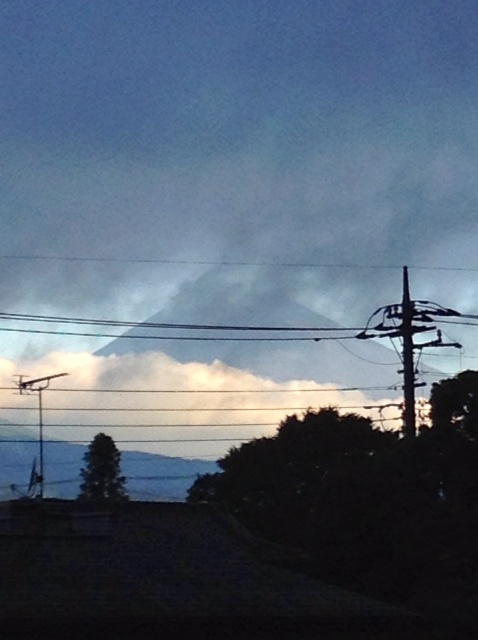
You are a bird flying between the black wire at center and the metallic wire at left. The distance between them is crucial for your flight path. Can you safely navigate the gap if your wingspan is 43 feet?

The black wire at center is 43.39 feet from the metallic wire at left, so yes, the bird can safely navigate the gap since its wingspan of 43 feet is slightly narrower than the distance between the wires.

You are an electrician inspecting power lines in the area. You notice two metallic wires in the scene. Which metallic wire is closer to you, the metallic wire at right or the metallic wire at left?

The metallic wire at right is closer to you because it is in front of the metallic wire at left.

You are an artist trying to sketch this scene. You notice two wires in the image. The metallic wire at right and the black wire at center. Which wire should you draw first if you want to follow the rule of drawing background elements before foreground elements?

The metallic wire at right is much taller than the black wire at center, so it is likely in the background. Therefore, you should draw the metallic wire at right first.